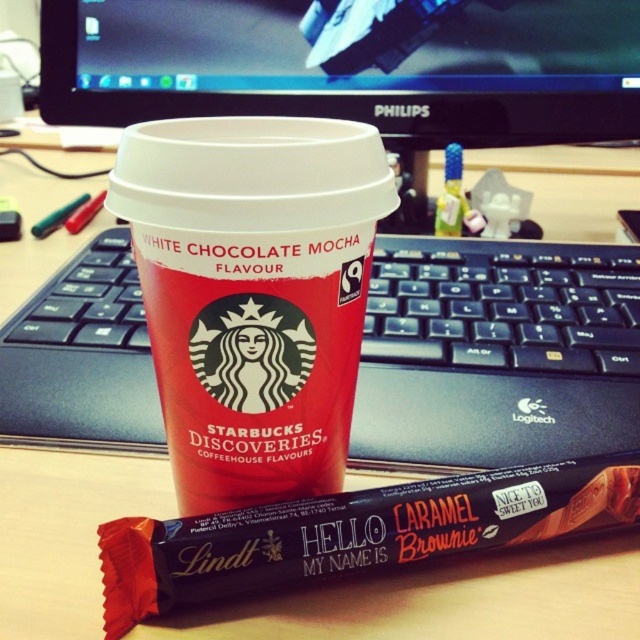
Is red matte paper cup at center below dark chocolate bar at center?

Actually, red matte paper cup at center is above dark chocolate bar at center.

Does red matte paper cup at center have a smaller size compared to dark chocolate bar at center?

No.

Measure the distance between point (189, 406) and camera.

Point (189, 406) and camera are 14.87 inches apart from each other.

Where is `red matte paper cup at center`? red matte paper cup at center is located at coordinates (253, 292).

Does black plastic keyboard at center have a smaller size compared to dark chocolate bar at center?

No, black plastic keyboard at center is not smaller than dark chocolate bar at center.

Between point (634, 294) and point (317, 528), which one is positioned in front?

Point (317, 528) is in front.

Where is `black plastic keyboard at center`? The image size is (640, 640). black plastic keyboard at center is located at coordinates (497, 353).

Who is shorter, black plastic keyboard at center or black glossy monitor at upper center?

Standing shorter between the two is black plastic keyboard at center.

Is black plastic keyboard at center wider than black glossy monitor at upper center?

No.

Is point (131, 326) positioned before point (320, 3)?

Yes, it is.

At what (x,y) coordinates should I click in order to perform the action: click on black plastic keyboard at center. Please return your answer as a coordinate pair (x, y). This screenshot has width=640, height=640. Looking at the image, I should click on (497, 353).